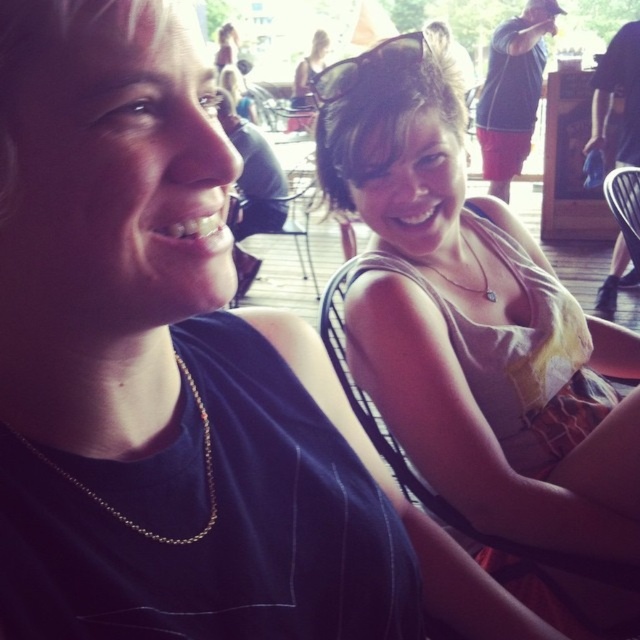
Which is more to the right, matte beige tank top at center or gold chain necklace at left?

From the viewer's perspective, matte beige tank top at center appears more on the right side.

Is matte beige tank top at center thinner than gold chain necklace at left?

No, matte beige tank top at center is not thinner than gold chain necklace at left.

Does point (561, 392) lie behind point (132, 528)?

Yes.

This screenshot has height=640, width=640. Find the location of `matte beige tank top at center`. matte beige tank top at center is located at coordinates (476, 330).

Between matte beige tank top at center and black plastic sunglasses at upper center, which one has less height?

With less height is black plastic sunglasses at upper center.

Between point (400, 365) and point (333, 97), which one is positioned behind?

The point (333, 97) is behind.

I want to click on matte beige tank top at center, so click(476, 330).

Is gold chain necklace at left below gold chain necklace at upper center?

Yes.

Can you confirm if gold chain necklace at left is positioned to the left of gold chain necklace at upper center?

Indeed, gold chain necklace at left is positioned on the left side of gold chain necklace at upper center.

Between point (182, 364) and point (445, 278), which one is positioned in front?

Point (182, 364)

Find the location of a particular element. The width and height of the screenshot is (640, 640). gold chain necklace at left is located at coordinates (116, 509).